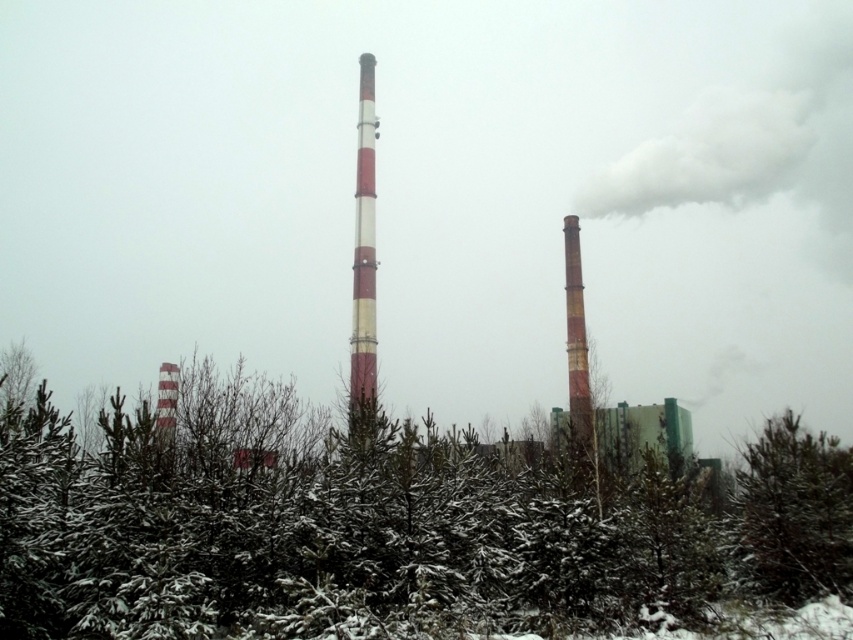
Question: Is red and white striped pole at center bigger than yellowish-brown textured chimney at right?

Choices:
 (A) no
 (B) yes

Answer: (B)

Question: Which point is closer to the camera taking this photo?

Choices:
 (A) (579, 326)
 (B) (357, 256)

Answer: (B)

Question: Does green matte tree at center appear over red and white striped pole at center?

Choices:
 (A) yes
 (B) no

Answer: (B)

Question: Observing the image, what is the correct spatial positioning of green matte tree at lower right in reference to red and white striped pole at center?

Choices:
 (A) below
 (B) above

Answer: (A)

Question: Which of the following is the closest to the observer?

Choices:
 (A) green matte tree at lower right
 (B) yellowish-brown textured chimney at right
 (C) green matte tree at center

Answer: (C)

Question: Which of the following is the farthest from the observer?

Choices:
 (A) (x=846, y=566)
 (B) (x=672, y=564)
 (C) (x=572, y=246)
 (D) (x=352, y=268)

Answer: (C)